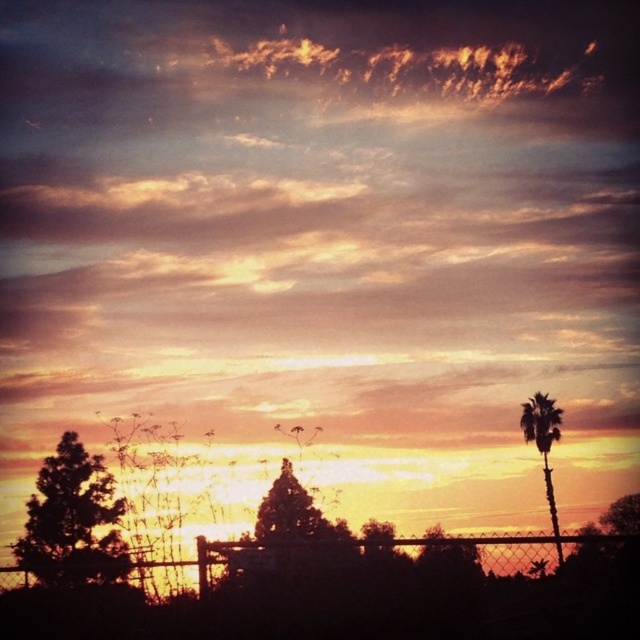
Is point (408, 577) positioned behind point (65, 502)?

No, (408, 577) is closer to viewer.

Is wire mesh fence at lower center below green leafy tree at lower left?

Indeed, wire mesh fence at lower center is positioned under green leafy tree at lower left.

This screenshot has height=640, width=640. In order to click on wire mesh fence at lower center in this screenshot , I will do `click(356, 602)`.

What are the coordinates of `wire mesh fence at lower center` in the screenshot? It's located at (356, 602).

Who is more distant from viewer, (625, 256) or (531, 420)?

The point (625, 256) is behind.

Is golden textured clouds at upper center to the left of silhouette palm tree at right from the viewer's perspective?

Correct, you'll find golden textured clouds at upper center to the left of silhouette palm tree at right.

Describe the element at coordinates (317, 216) in the screenshot. I see `golden textured clouds at upper center` at that location.

Where is `golden textured clouds at upper center`? The height and width of the screenshot is (640, 640). golden textured clouds at upper center is located at coordinates (317, 216).

Is point (433, 568) more distant than point (544, 465)?

No, it is in front of (544, 465).

Is wire mesh fence at lower center below silhouette palm tree at right?

Yes.

The width and height of the screenshot is (640, 640). What are the coordinates of `wire mesh fence at lower center` in the screenshot? It's located at (356, 602).